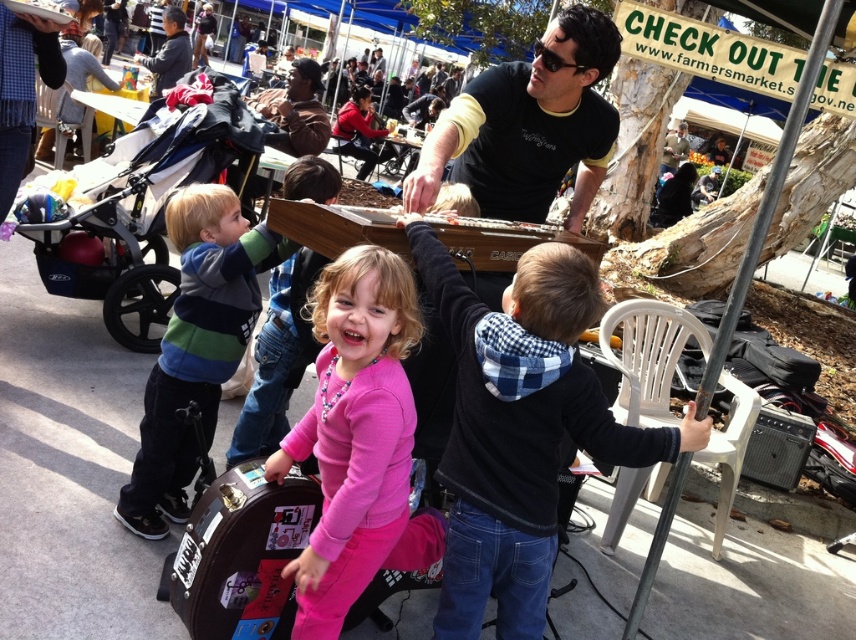
Question: Which object is positioned closest to the matte black jacket at upper left?

Choices:
 (A) pink matte dress at center
 (B) black matte shirt at upper center

Answer: (B)

Question: Is plaid hoodie at center below matte black jacket at upper left?

Choices:
 (A) no
 (B) yes

Answer: (B)

Question: Is plaid hoodie at center thinner than pink matte dress at center?

Choices:
 (A) no
 (B) yes

Answer: (A)

Question: Among these objects, which one is nearest to the camera?

Choices:
 (A) matte black jacket at upper left
 (B) black matte shirt at upper center
 (C) plaid hoodie at center
 (D) pink matte dress at center

Answer: (D)

Question: Can you confirm if pink matte dress at center is smaller than matte black jacket at upper left?

Choices:
 (A) no
 (B) yes

Answer: (B)

Question: Which point appears farthest from the camera in this image?

Choices:
 (A) (513, 316)
 (B) (342, 616)

Answer: (B)